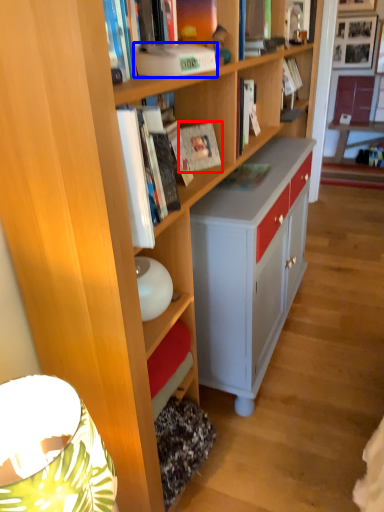
Question: Which point is closer to the camera, paperback book (highlighted by a red box) or paperback book (highlighted by a blue box)?

Choices:
 (A) paperback book
 (B) paperback book

Answer: (B)